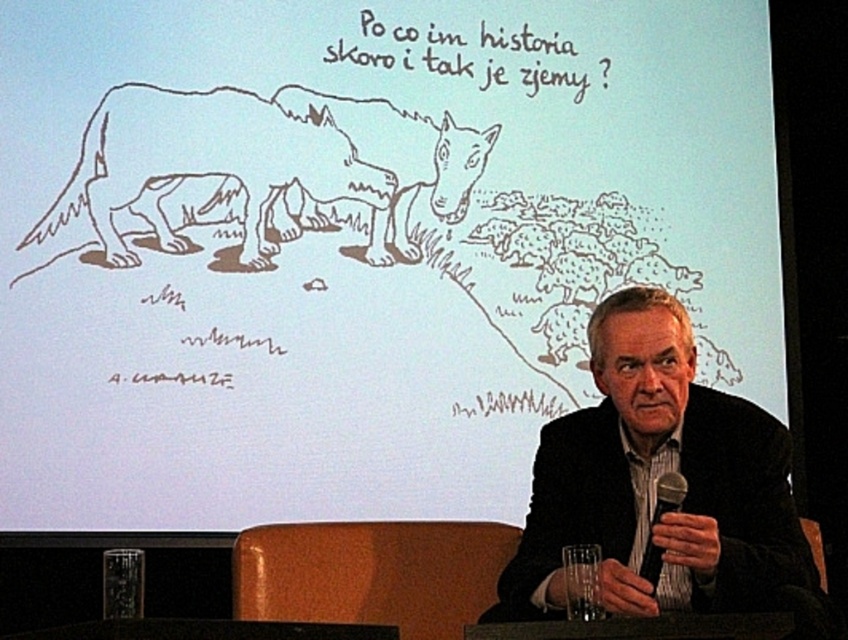
Consider the image. Between brown sketchy wolf at upper left and black metallic microphone at lower center, which one has less height?

black metallic microphone at lower center is shorter.

Locate an element on the screen. The width and height of the screenshot is (848, 640). brown sketchy wolf at upper left is located at coordinates (255, 176).

Can you confirm if black textured suit at center is positioned below brown sketchy wolf at upper left?

Correct, black textured suit at center is located below brown sketchy wolf at upper left.

How much distance is there between black textured suit at center and brown sketchy wolf at upper left?

They are 1.39 meters apart.

What do you see at coordinates (656, 483) in the screenshot? The width and height of the screenshot is (848, 640). I see `black textured suit at center` at bounding box center [656, 483].

The height and width of the screenshot is (640, 848). I want to click on black textured suit at center, so click(656, 483).

Measure the distance between black textured suit at center and black metallic microphone at lower center.

They are 6.60 inches apart.

Is black textured suit at center in front of black metallic microphone at lower center?

Yes, it is.

The image size is (848, 640). Find the location of `black textured suit at center`. black textured suit at center is located at coordinates (656, 483).

Identify the location of black textured suit at center. This screenshot has width=848, height=640. (656, 483).